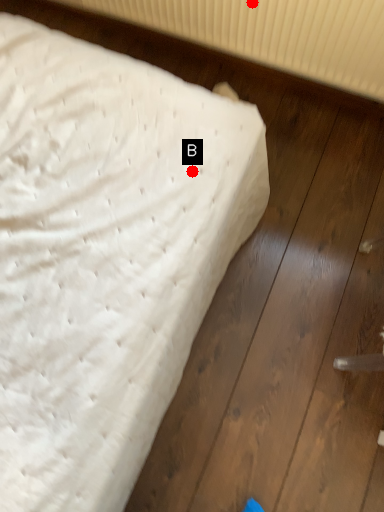
Question: Two points are circled on the image, labeled by A and B beside each circle. Which point is closer to the camera taking this photo?

Choices:
 (A) A is closer
 (B) B is closer

Answer: (B)